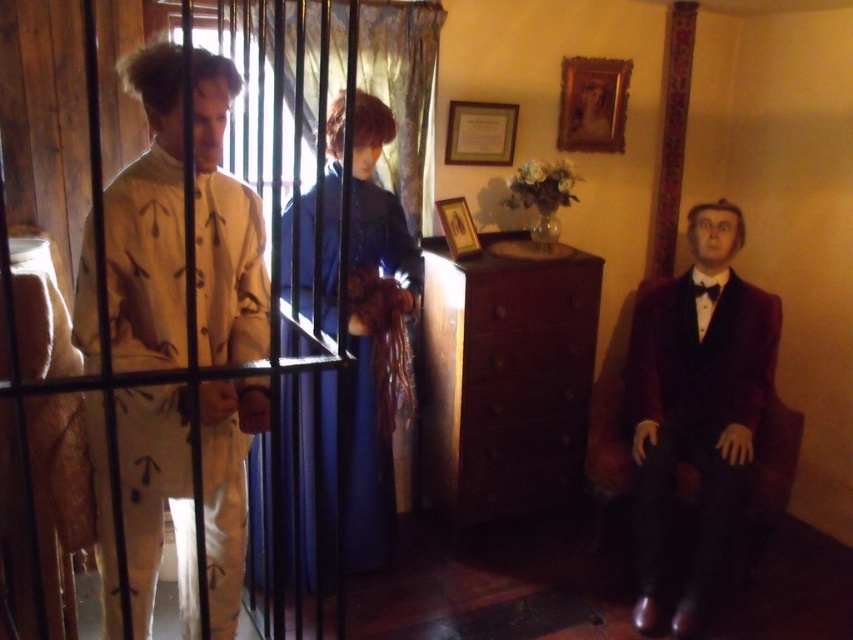
You are a photographer who needs to position a camera to capture both the brushed metal cage at left and the seated mannequin on the right. Given the distance between the camera and the cage is 4.24 feet, will the seated mannequin also be in frame?

The camera is 4.24 feet away from the brushed metal cage at left. Since the seated mannequin is on the right side of the cage, it should be within the camera frame if the camera is positioned to include both objects.

You are an interior designer planning to place a new decorative item at point (695,406) in the room. However, you notice something already exists there. What object is located at that specific coordinate?

The velvet dark suit at right is located at point (695,406).